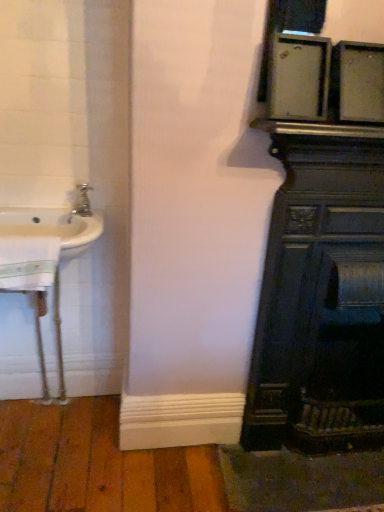
Question: From a real-world perspective, is white glossy sink at left physically below dark wood fireplace at right?

Choices:
 (A) yes
 (B) no

Answer: (B)

Question: Is white glossy sink at left closer to camera compared to dark wood fireplace at right?

Choices:
 (A) no
 (B) yes

Answer: (A)

Question: Does white glossy sink at left have a lesser width compared to dark wood fireplace at right?

Choices:
 (A) no
 (B) yes

Answer: (A)

Question: Considering the relative sizes of white glossy sink at left and dark wood fireplace at right in the image provided, is white glossy sink at left shorter than dark wood fireplace at right?

Choices:
 (A) yes
 (B) no

Answer: (A)

Question: Would you say white glossy sink at left is a long distance from dark wood fireplace at right?

Choices:
 (A) yes
 (B) no

Answer: (B)

Question: Looking at their shapes, would you say dark wood fireplace at right is wider or thinner than brushed metal faucet at left?

Choices:
 (A) wide
 (B) thin

Answer: (A)

Question: Is point (360, 438) positioned closer to the camera than point (87, 183)?

Choices:
 (A) closer
 (B) farther

Answer: (B)

Question: From the image's perspective, is dark wood fireplace at right positioned above or below brushed metal faucet at left?

Choices:
 (A) above
 (B) below

Answer: (B)

Question: From their relative heights in the image, would you say dark wood fireplace at right is taller or shorter than brushed metal faucet at left?

Choices:
 (A) short
 (B) tall

Answer: (B)

Question: From a real-world perspective, is white glossy sink at left above or below brushed metal faucet at left?

Choices:
 (A) above
 (B) below

Answer: (B)

Question: In terms of height, does white glossy sink at left look taller or shorter compared to brushed metal faucet at left?

Choices:
 (A) tall
 (B) short

Answer: (A)

Question: Would you say white glossy sink at left is to the left or to the right of brushed metal faucet at left in the picture?

Choices:
 (A) right
 (B) left

Answer: (B)

Question: Is white glossy sink at left inside or outside of brushed metal faucet at left?

Choices:
 (A) inside
 (B) outside

Answer: (B)

Question: Which is correct: brushed metal faucet at left is inside white glossy sink at left, or outside of it?

Choices:
 (A) inside
 (B) outside

Answer: (B)

Question: From their relative heights in the image, would you say brushed metal faucet at left is taller or shorter than white glossy sink at left?

Choices:
 (A) short
 (B) tall

Answer: (A)